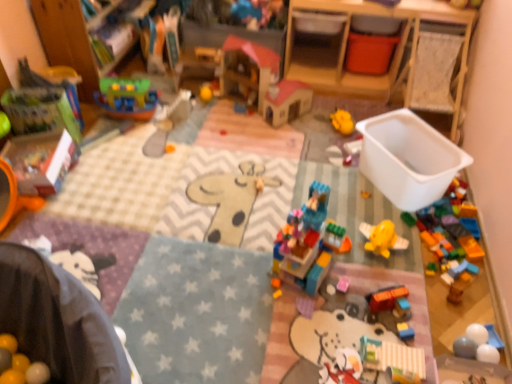
Identify the location of vacant area that lies in front of orange matte car at center, the 2th toy from the bottom. (387, 334).